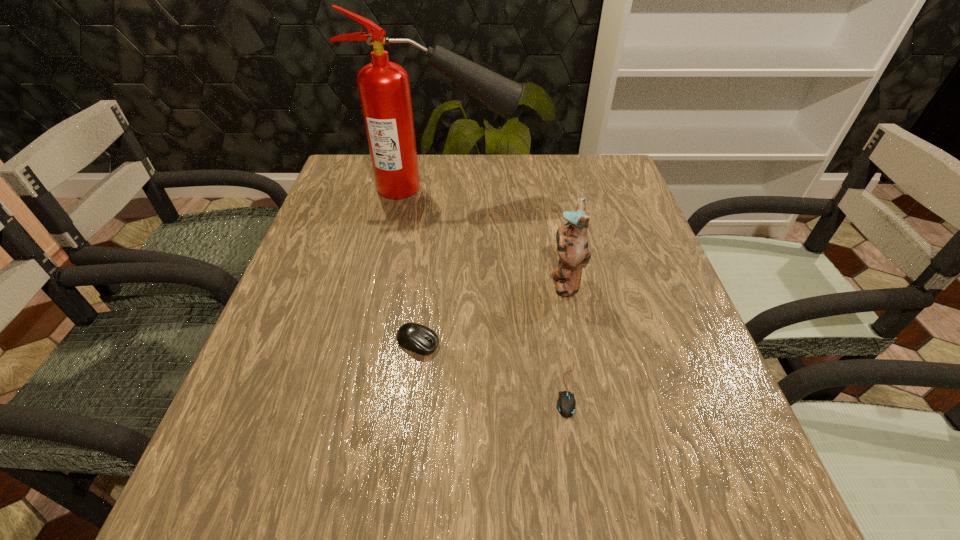
At what (x,y) coordinates should I click in order to perform the action: click on vacant region between the figurine and the tallest object. Please return your answer as a coordinate pair (x, y). The width and height of the screenshot is (960, 540). Looking at the image, I should click on (502, 235).

This screenshot has width=960, height=540. Identify the location of free spot between the taller mouse and the fire extinguisher. [429, 266].

Where is `vacant region between the tallest object and the third tallest object`? vacant region between the tallest object and the third tallest object is located at coordinates (429, 266).

Where is `object identified as the second closest to the figurine`? object identified as the second closest to the figurine is located at coordinates (420, 339).

Select which object is the closest to the tallest object. Please provide its 2D coordinates. Your answer should be formatted as a tuple, i.e. [(x, y)], where the tuple contains the x and y coordinates of a point satisfying the conditions above.

[(572, 242)]

Identify the location of free space that satisfies the following two spatial constraints: 1. at the nozzle of the farthest object; 2. on the right side of the shortest object. (415, 389).

Where is `vacant space that satisfies the following two spatial constraints: 1. at the nozzle of the tallest object; 2. on the right side of the nearer mouse`? This screenshot has height=540, width=960. vacant space that satisfies the following two spatial constraints: 1. at the nozzle of the tallest object; 2. on the right side of the nearer mouse is located at coordinates click(415, 389).

I want to click on free space that satisfies the following two spatial constraints: 1. at the nozzle of the farthest object; 2. on the front side of the farther mouse, so click(420, 343).

Identify the location of free spot that satisfies the following two spatial constraints: 1. on the front side of the shorter mouse; 2. on the right side of the third farthest object. (413, 389).